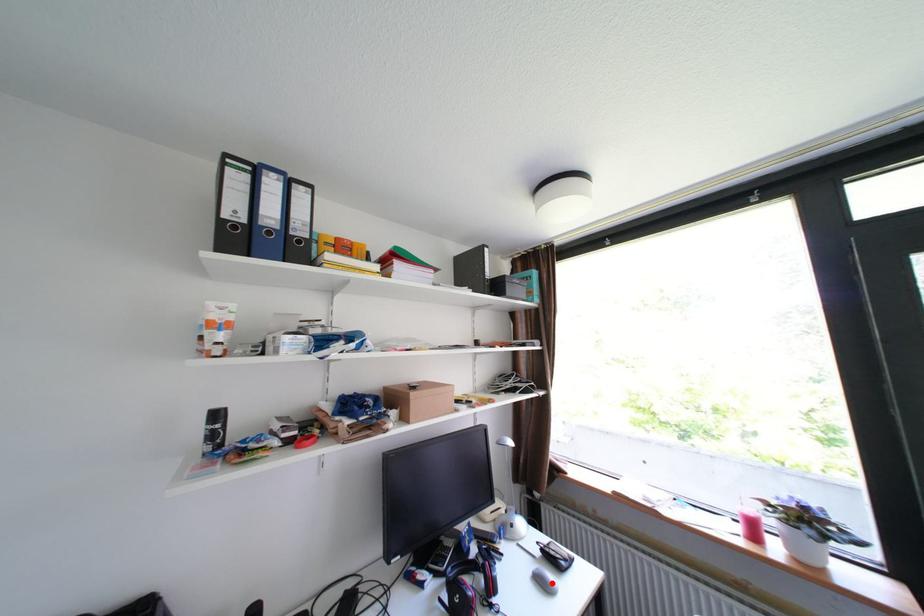
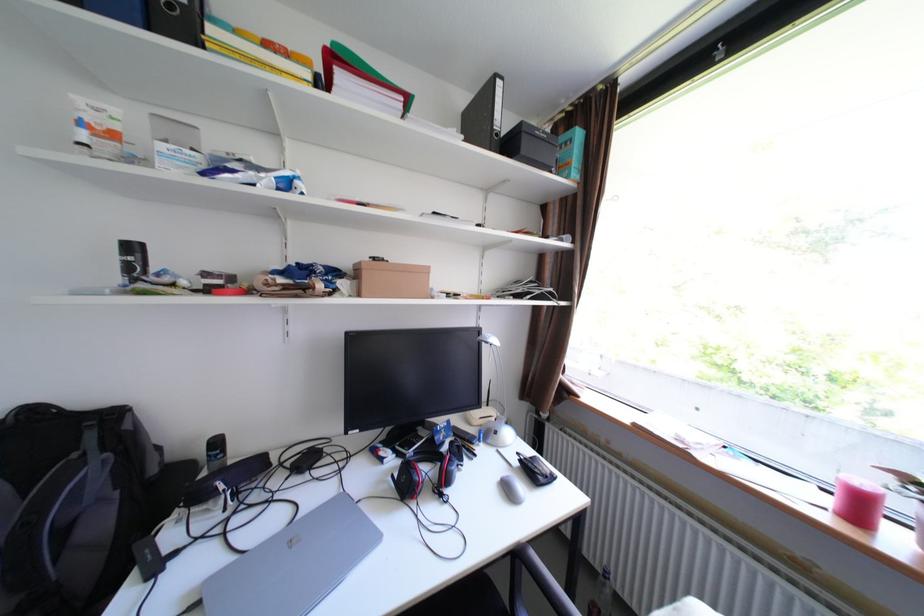
The point at the highlighted location is marked in the first image. Where is the corresponding point in the second image?

(517, 490)